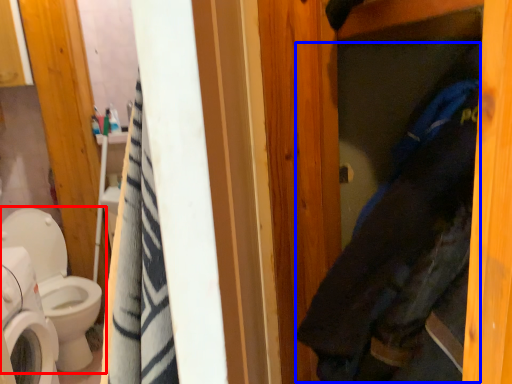
Question: Which object appears closest to the camera in this image, toilet (highlighted by a red box) or clothing (highlighted by a blue box)?

Choices:
 (A) toilet
 (B) clothing

Answer: (B)